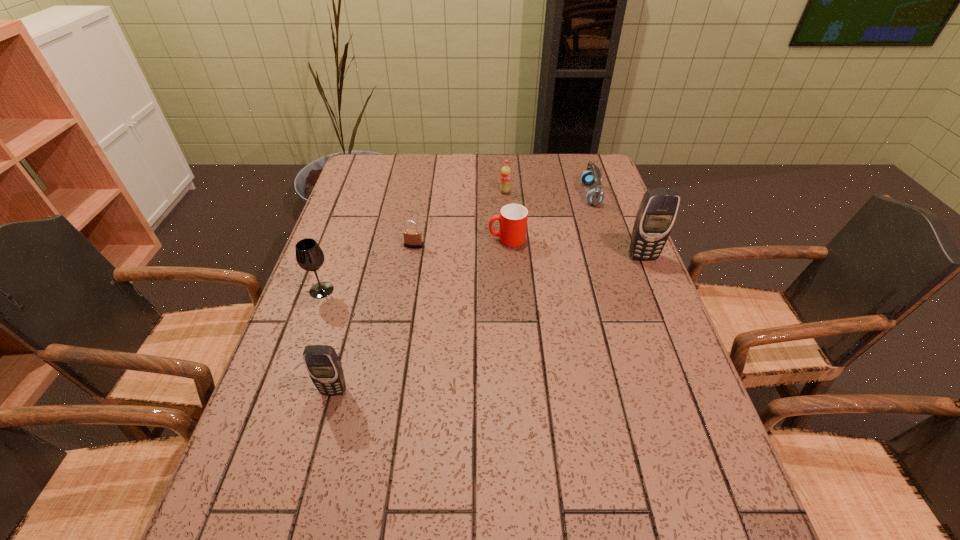
This screenshot has height=540, width=960. Identify the location of free space between the taller cellular telephone and the padlock. (528, 251).

Locate which object is the fourth closest to the soda. Please provide its 2D coordinates. Your answer should be formatted as a tuple, i.e. [(x, y)], where the tuple contains the x and y coordinates of a point satisfying the conditions above.

[(657, 212)]

Locate which object ranks sixth in proximity to the right cellular telephone. Please provide its 2D coordinates. Your answer should be formatted as a tuple, i.e. [(x, y)], where the tuple contains the x and y coordinates of a point satisfying the conditions above.

[(309, 255)]

Find the location of a particular element. vacant space that satisfies the following two spatial constraints: 1. on the ear cups of the sixth object from left to right; 2. on the front face of the nearer cellular telephone is located at coordinates (654, 390).

The image size is (960, 540). Identify the location of blank area in the image that satisfies the following two spatial constraints: 1. on the side of the cup with the handle; 2. on the back side of the soda. (504, 192).